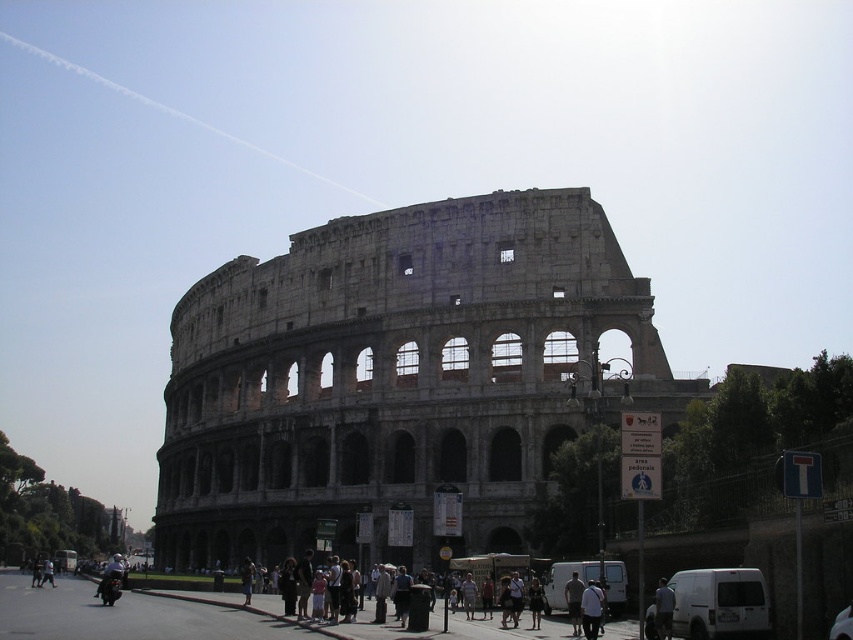
You are standing at the Colosseum and want to take a photo of the two points marked in the image. Which point, point (x=665, y=600) or point (x=578, y=584), is closer to you?

Point (x=665, y=600) is in front of point (x=578, y=584), so it is closer to you.

You are a tour guide at the Colosseum. You notice two visitors wearing a light blue shirt at center and a light brown leather jacket at center. Which visitor is closer to the Colosseum?

The light brown leather jacket at center is closer to the Colosseum because the light blue shirt at center is to the right of it, meaning the light brown leather jacket is positioned to the left and thus closer to the central structure.

You are standing at point 0.5, 0.5 in the image. Which direction should you move to reach the gray stone amphitheater at center?

The gray stone amphitheater at center is located at point [395,378]. Since you are at [426,320], you should move slightly to the right and down to reach it.